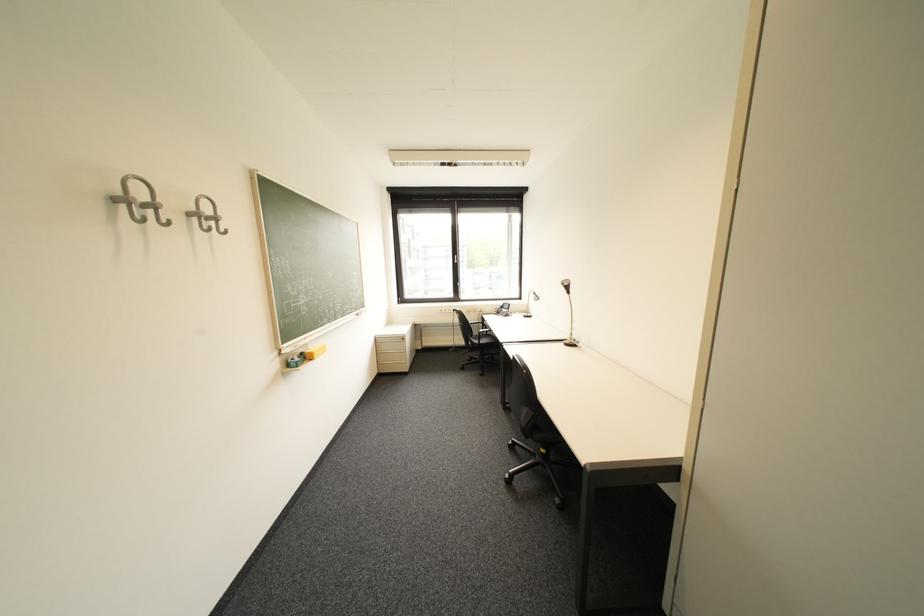
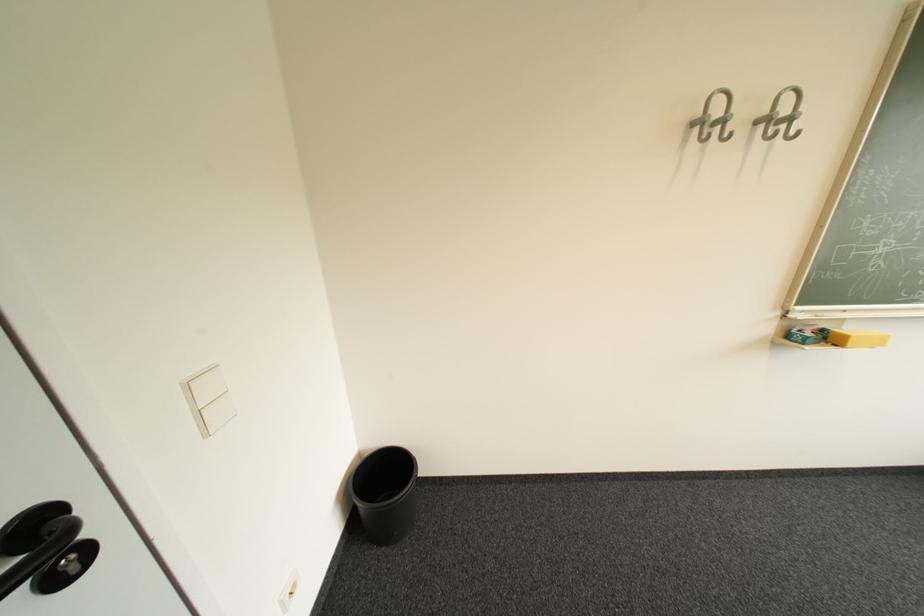
Find the pixel in the second image that matches [322,361] in the first image.

(846, 346)